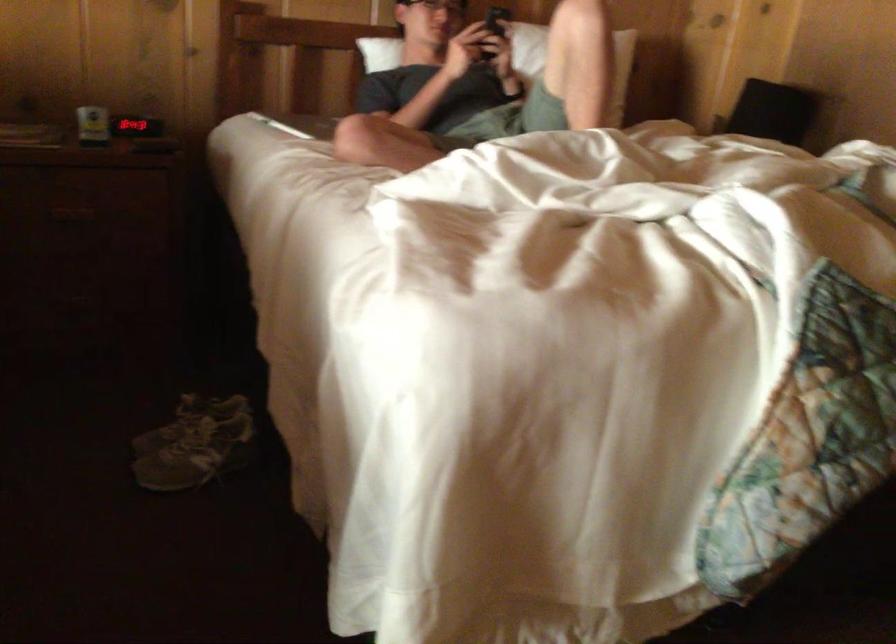
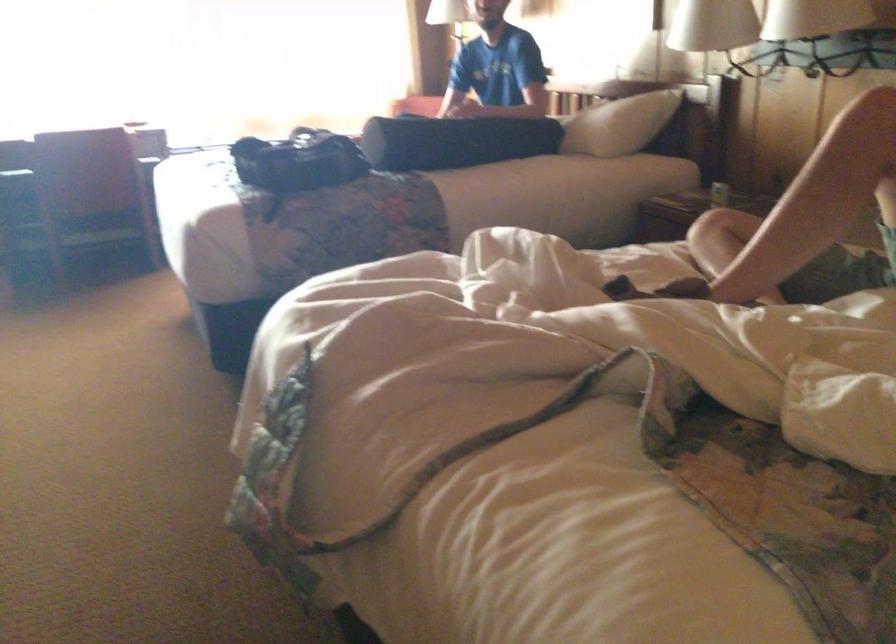
Question: I am providing you with two images of the same scene from different viewpoints. After the viewpoint changes to image2, which objects are now occluded?

Choices:
 (A) gray shoe
 (B) black bolster pillow
 (C) black bag
 (D) yellow floor outlet

Answer: (A)